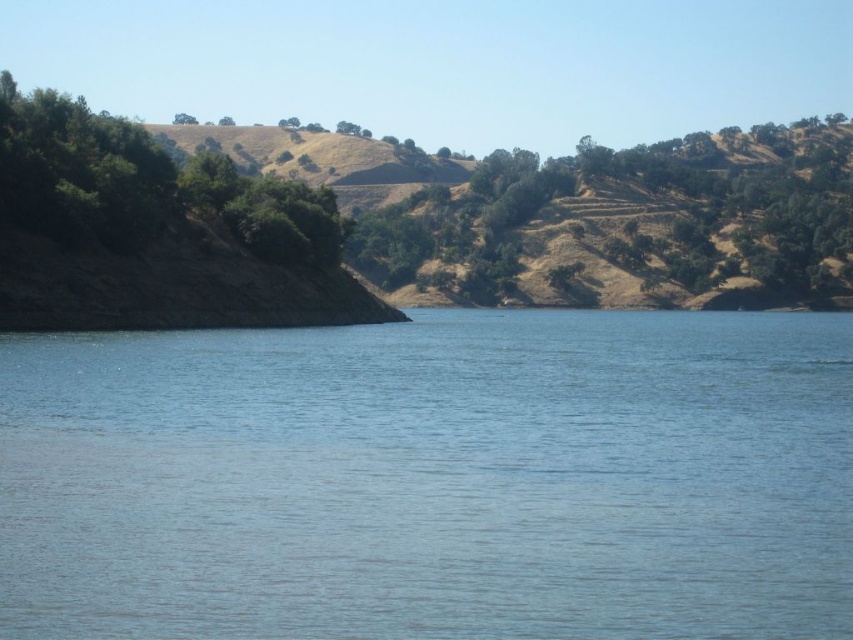
From the picture: Who is taller, blue water at center or green leafy tree at upper center?

With more height is green leafy tree at upper center.

Between blue water at center and green leafy tree at upper center, which one appears on the left side from the viewer's perspective?

Positioned to the left is green leafy tree at upper center.

Who is more distant from viewer, (627, 355) or (193, 122)?

Point (193, 122)

Find the location of a particular element. blue water at center is located at coordinates point(432,477).

Does dry grassy hillside at upper center appear on the left side of green leafy tree at upper center?

No, dry grassy hillside at upper center is not to the left of green leafy tree at upper center.

Image resolution: width=853 pixels, height=640 pixels. Find the location of `dry grassy hillside at upper center`. dry grassy hillside at upper center is located at coordinates (314, 154).

Is blue water at center below dry grassy hillside at upper center?

Correct, blue water at center is located below dry grassy hillside at upper center.

Is point (178, 400) farther from viewer compared to point (436, 163)?

No, it is in front of (436, 163).

Between point (846, 410) and point (323, 173), which one is positioned behind?

The point (323, 173) is behind.

Locate an element on the screen. blue water at center is located at coordinates (432, 477).